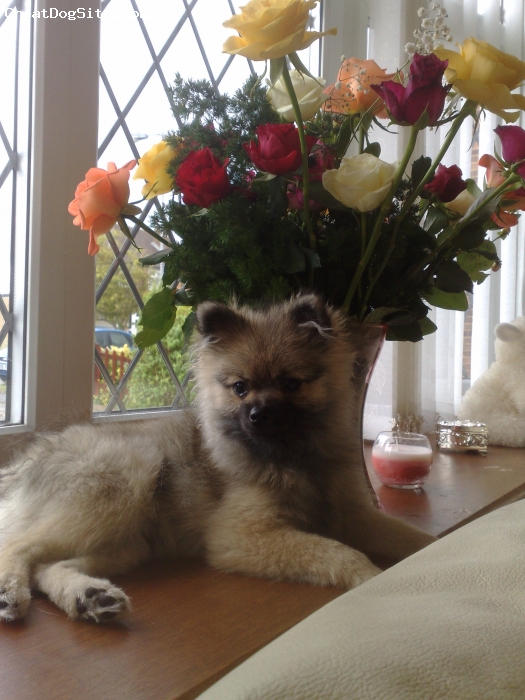
Where is `silver trinket box`? silver trinket box is located at coordinates (457, 437).